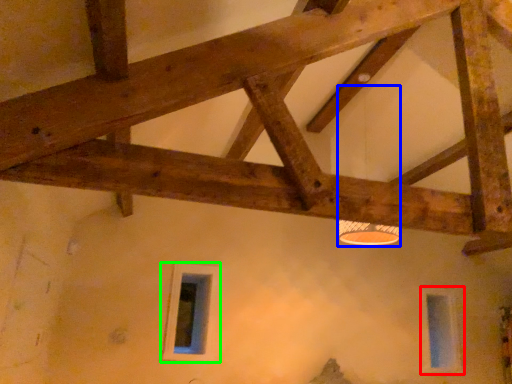
Question: Estimate the real-world distances between objects in this image. Which object is farther from window (highlighted by a red box), lamp (highlighted by a blue box) or window (highlighted by a green box)?

Choices:
 (A) lamp
 (B) window

Answer: (B)